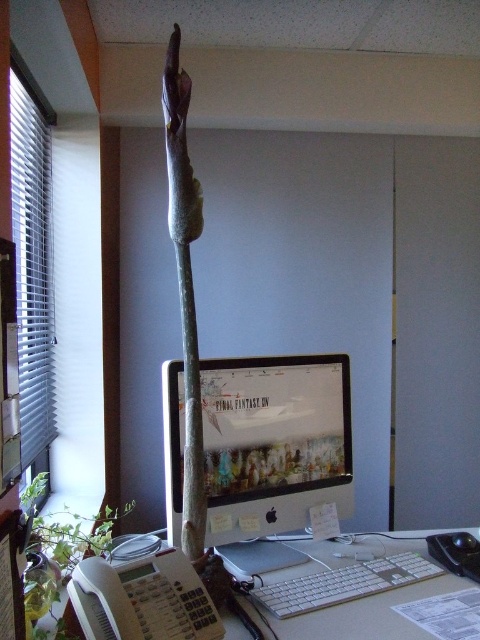
You are organizing the desk and want to place a new item between the white plastic keyboard at lower center and the green leafy plant at lower left. Is there enough space for a 10cm wide item?

The white plastic keyboard at lower center is positioned on the right side of the green leafy plant at lower left. Since the keyboard is to the right of the plant, there is space between them. A 10cm wide item can fit in this space.

Consider the image. You are a delivery person who needs to place a new camera on the desk. The camera requires a minimum of 4 feet of space between it and the matte plastic monitor at center to avoid interference. Based on the current setup, can you safely place the camera on the desk without violating this requirement?

The matte plastic monitor at center and camera are 4.04 feet apart from each other. Since 4.04 feet is just over the required 4 feet minimum distance, the camera can be safely placed on the desk without violating the interference requirement.

You are organizing the desk and need to place a new item between the matte plastic monitor at center and the green leafy plant at lower left. Considering their heights, which object should be placed lower to maintain visual balance?

To maintain visual balance, the green leafy plant at lower left should be placed lower since the matte plastic monitor at center is taller than it.